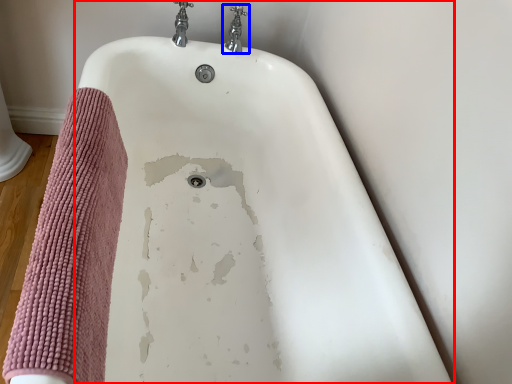
Question: Which point is closer to the camera, bathtub (highlighted by a red box) or tap (highlighted by a blue box)?

Choices:
 (A) bathtub
 (B) tap

Answer: (A)